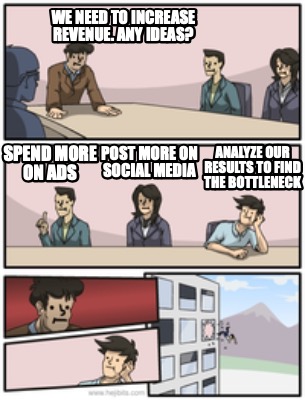
Image resolution: width=305 pixels, height=400 pixels. I want to click on panel, so click(x=236, y=304), click(x=83, y=300), click(x=95, y=204), click(x=135, y=82).